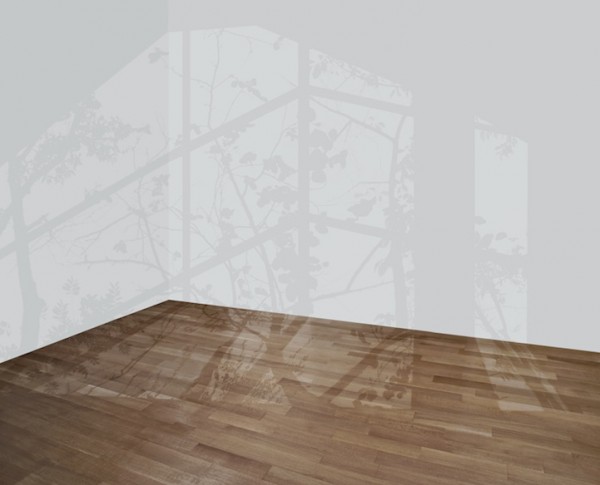
At what (x,y) coordinates should I click in order to perform the action: click on right white wall in background. Please return your answer as a coordinate pair (x, y). This screenshot has width=600, height=485. Looking at the image, I should click on (353, 303).